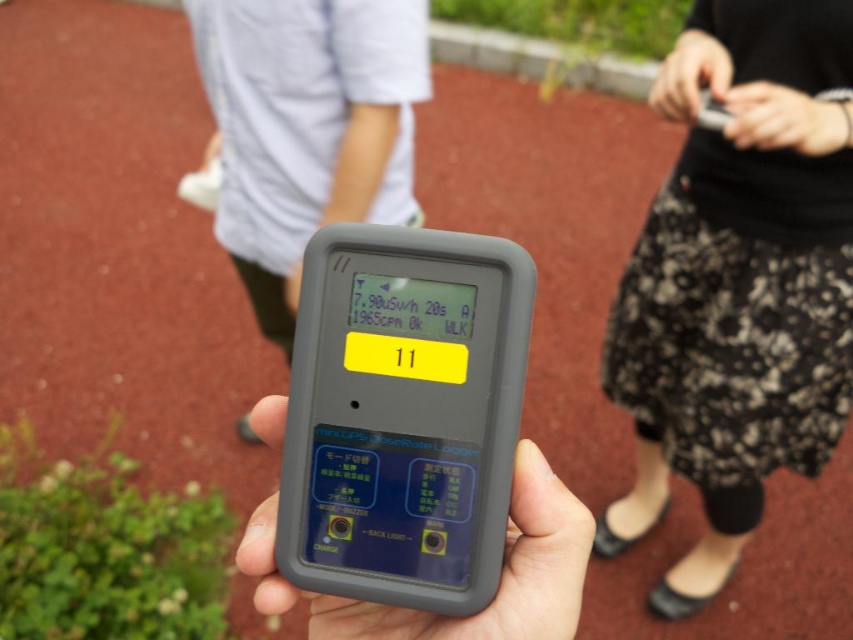
The width and height of the screenshot is (853, 640). Describe the element at coordinates (738, 282) in the screenshot. I see `black lace skirt at lower right` at that location.

Does black lace skirt at lower right have a lesser height compared to black rubberized device at center?

No, black lace skirt at lower right is not shorter than black rubberized device at center.

Is point (744, 52) farther from camera compared to point (454, 621)?

Yes.

Where is `black lace skirt at lower right`? Image resolution: width=853 pixels, height=640 pixels. black lace skirt at lower right is located at coordinates (738, 282).